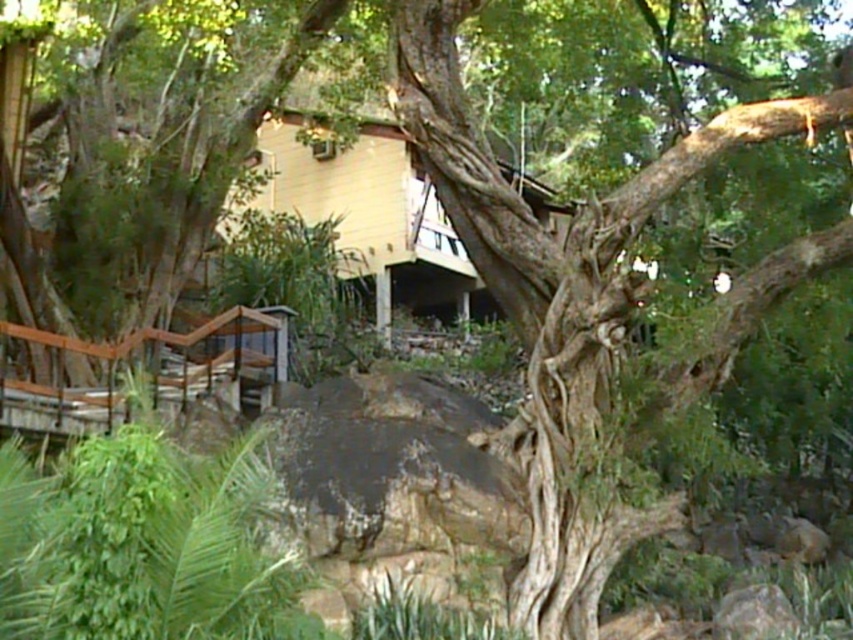
You are standing at the base of the tree and want to reach the wooden staircase. There are two stones in your path, the gray rough stone at lower right and the brown rough stone at lower right. Which stone should you step over first to reach the staircase?

The gray rough stone at lower right is in front of the brown rough stone at lower right, so you should step over the gray rough stone at lower right first to reach the staircase.

Consider the image. You are standing at the base of the tree and looking towards the wooden staircase. Which of the stones at the lower right is closer to you, the gray rough stone at lower right or the brown rough stone at lower right?

The gray rough stone at lower right is closer to you because it is located below the brown rough stone at lower right, meaning it is positioned in front of the brown rough stone at lower right from your viewpoint.